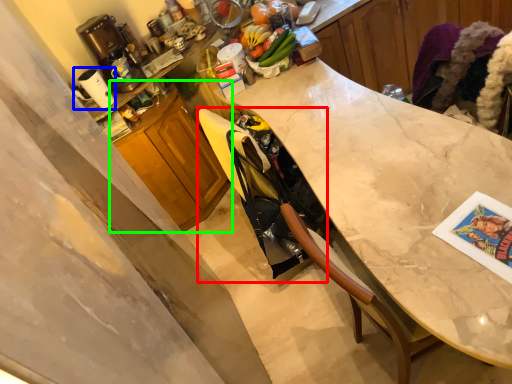
Question: Which object is the farthest from swivel chair (highlighted by a red box)? Choose among these: appliance (highlighted by a blue box) or cabinetry (highlighted by a green box).

Choices:
 (A) appliance
 (B) cabinetry

Answer: (A)